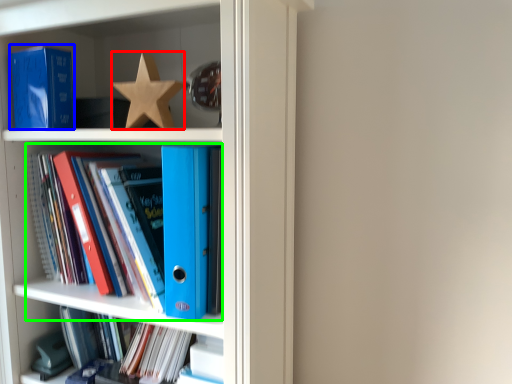
Question: Which is farther away from star (highlighted by a red box)? paperback book (highlighted by a blue box) or book (highlighted by a green box)?

Choices:
 (A) paperback book
 (B) book

Answer: (B)